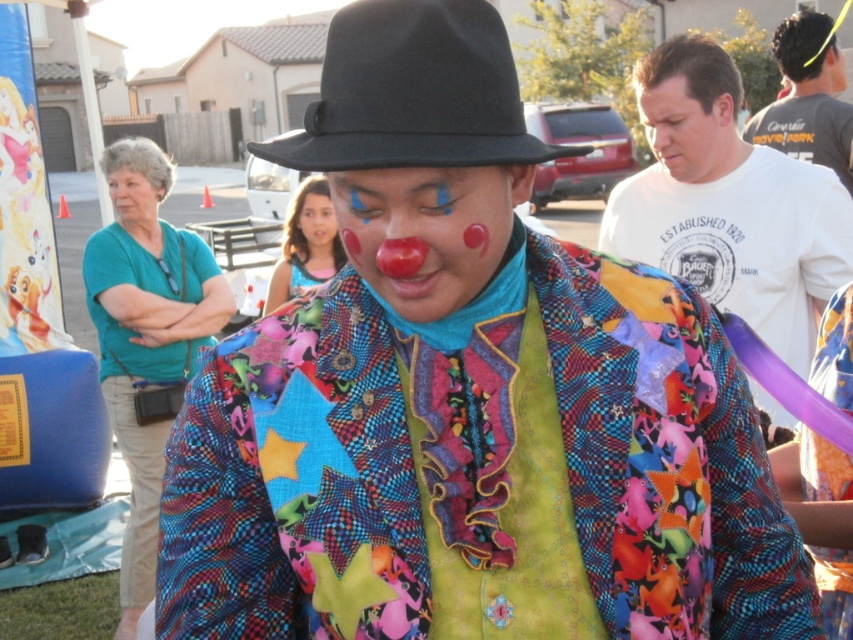
You are standing in the middle of the scene and want to move towards the closest point between point (437,195) and point (706,125). Which point should you walk towards?

Point (437,195) is closer to the viewer than point (706,125), so you should walk towards point (437,195).

You are a photographer at the event and want to capture a clear shot of both the black felt fedora at upper center and the smooth skin face at center. Based on their heights, which object should you focus on first to ensure both are in frame?

The black felt fedora at upper center is not as tall as the smooth skin face at center, so you should focus on the smooth skin face at center first to ensure both are in frame.

You are a photographer at the event and want to capture a closeup of the clown performer. The camera you are using has a limited focus range. Which object should you focus on first to ensure both the matte clown nose at center and the smooth skin face at upper right are in focus?

The matte clown nose at center should be focused on first because it is closer to the camera than the smooth skin face at upper right, ensuring both will be in focus when focusing on the closer object.